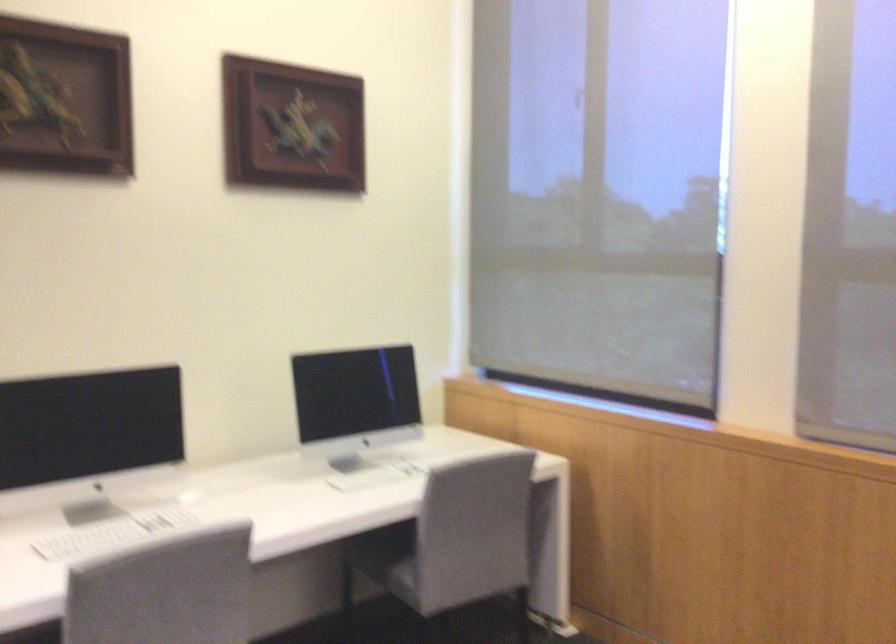
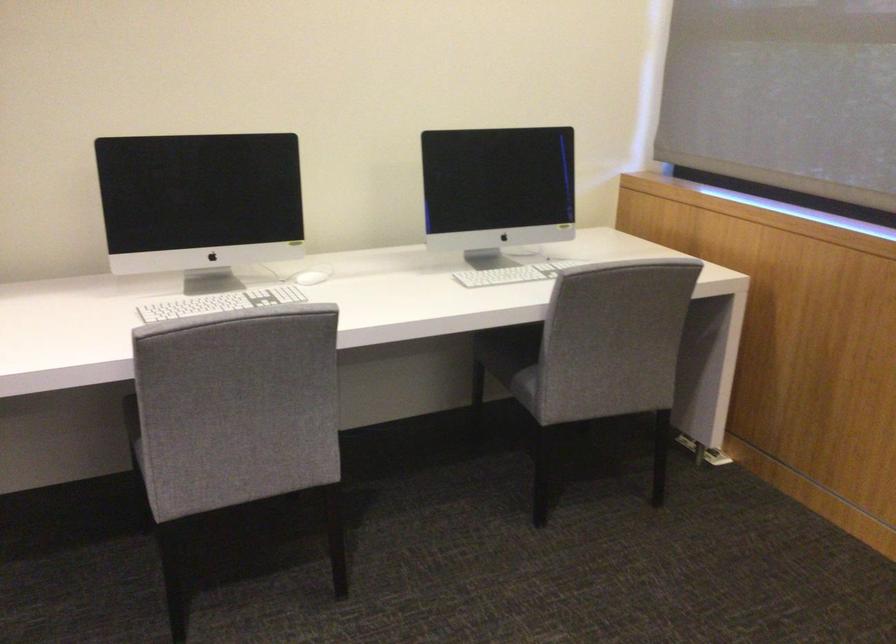
The point at (200, 495) is marked in the first image. Where is the corresponding point in the second image?

(307, 277)